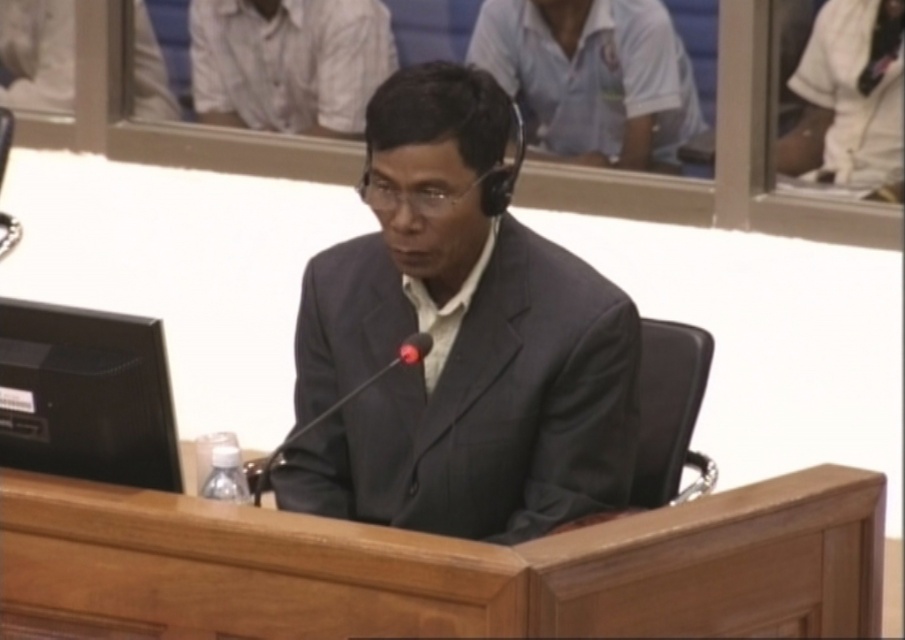
You are a photographer standing at the camera position. You need to place a 2.0 meter long banner behind the wooden table at center. Will the banner fit horizontally behind the table if the table is 1.95 meters away from the camera?

The wooden table at center is 1.95 meters away from the camera. The banner is 2.0 meters long. Since the distance from the camera to the table is shorter than the banner length, the banner may not fit horizontally behind the table as it might extend beyond the camera frame.

You are an assistant in a courtroom setting. You need to determine which clothing item is narrower between the matte black suit at center and the white matte shirt at upper center. Which one is it?

The matte black suit at center is thinner than the white matte shirt at upper center, so the matte black suit at center is narrower.

You are standing in the courtroom and need to move from the point at coordinates point (589,328) to the point at coordinates point (684,65). Which direction should you move?

You should move backward because point (589,328) is in front of point (684,65).